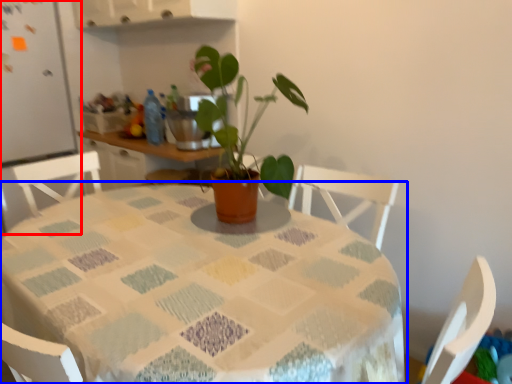
Question: Which object is closer to the camera taking this photo, fridge (highlighted by a red box) or table (highlighted by a blue box)?

Choices:
 (A) fridge
 (B) table

Answer: (B)